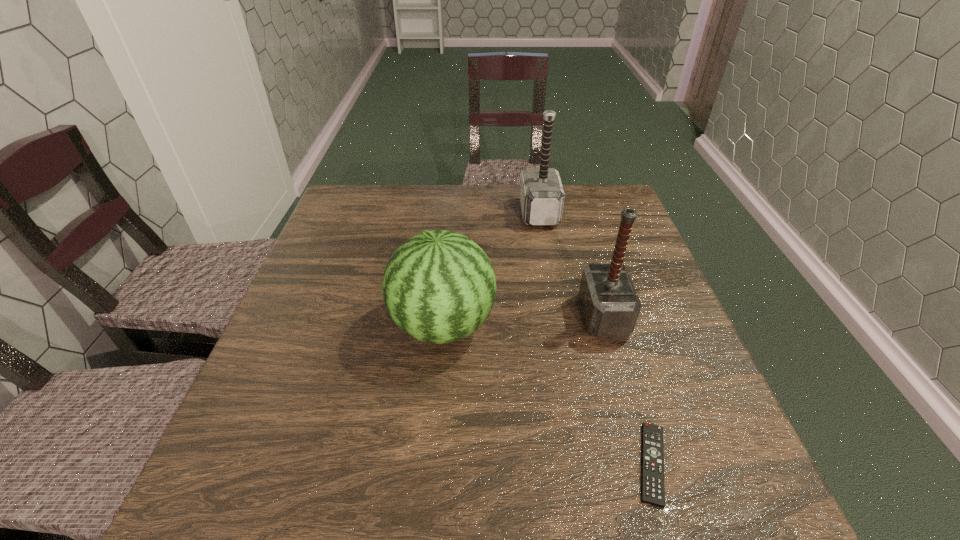
Locate which object ranks third in proximity to the nearer hammer. Please provide its 2D coordinates. Your answer should be formatted as a tuple, i.e. [(x, y)], where the tuple contains the x and y coordinates of a point satisfying the conditions above.

[(542, 196)]

Image resolution: width=960 pixels, height=540 pixels. What are the coordinates of `object that can be found as the second closest to the leftmost object` in the screenshot? It's located at (652, 488).

I want to click on vacant space that satisfies the following two spatial constraints: 1. for striking with the head of the farthest object; 2. on the back side of the nearer hammer, so [x=559, y=317].

Locate an element on the screen. The width and height of the screenshot is (960, 540). vacant space that satisfies the following two spatial constraints: 1. for striking with the head of the farthest object; 2. on the back side of the nearer hammer is located at coordinates (559, 317).

This screenshot has width=960, height=540. I want to click on free space that satisfies the following two spatial constraints: 1. for striking with the head of the farthest object; 2. on the front side of the leftmost object, so click(560, 326).

Image resolution: width=960 pixels, height=540 pixels. In order to click on vacant space that satisfies the following two spatial constraints: 1. for striking with the head of the farthest object; 2. on the back side of the nearer hammer in this screenshot , I will do `click(559, 317)`.

Where is `free region that satisfies the following two spatial constraints: 1. on the back side of the nearer hammer; 2. on the right side of the watermelon`? This screenshot has height=540, width=960. free region that satisfies the following two spatial constraints: 1. on the back side of the nearer hammer; 2. on the right side of the watermelon is located at coordinates (444, 317).

Where is `free spot that satisfies the following two spatial constraints: 1. on the front side of the nearer hammer; 2. on the right side of the shortest object`? The height and width of the screenshot is (540, 960). free spot that satisfies the following two spatial constraints: 1. on the front side of the nearer hammer; 2. on the right side of the shortest object is located at coordinates click(x=646, y=463).